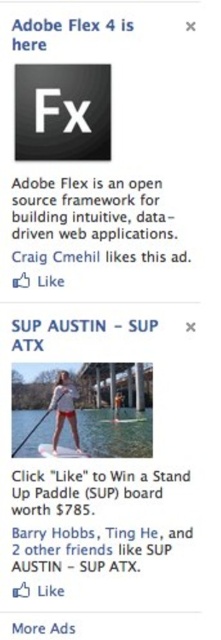
Question: Which point is closer to the camera?

Choices:
 (A) white fabric paddle at center
 (B) white fabric shorts at center
 (C) white glossy water ski at lower center

Answer: (C)

Question: Which object is closer to the camera taking this photo?

Choices:
 (A) white plastic water ski at center
 (B) white fabric paddle at center

Answer: (A)

Question: Does white glossy water ski at lower center have a greater width compared to white fabric paddle at center?

Choices:
 (A) yes
 (B) no

Answer: (A)

Question: Does white fabric shorts at center appear under white glossy water ski at lower center?

Choices:
 (A) yes
 (B) no

Answer: (B)

Question: Does white plastic water ski at center appear over white fabric paddle at center?

Choices:
 (A) yes
 (B) no

Answer: (A)

Question: Which object is closer to the camera taking this photo?

Choices:
 (A) white fabric paddle at center
 (B) white fabric shorts at center
 (C) white glossy water ski at lower center
 (D) white plastic water ski at center

Answer: (C)